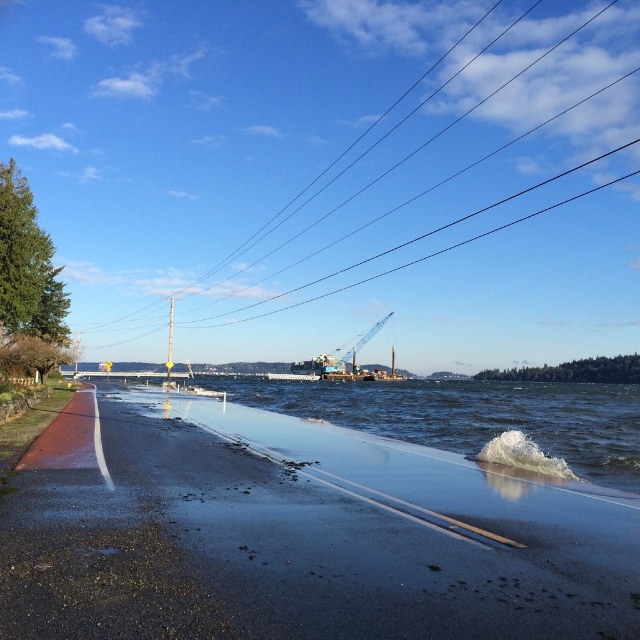
You are standing at the edge of the shiny asphalt road at lower left and want to walk to the metallic blue crane at center. Which direction should you walk to reach it?

To reach the metallic blue crane at center from the shiny asphalt road at lower left, you should walk towards the center of the image since the shiny asphalt road at lower left is in front of the metallic blue crane at center.

You are a delivery person who needs to cross the black wire at upper center and the shiny asphalt road at lower left. Which one is wider so you can choose the easier path to walk?

The black wire at upper center is wider than the shiny asphalt road at lower left, so you should choose the black wire at upper center as the easier path to walk.